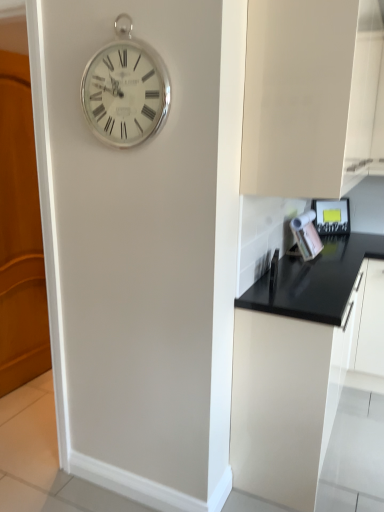
What is the approximate width of silver metallic clock at upper center?

silver metallic clock at upper center is 3.44 centimeters wide.

Describe the element at coordinates (20, 234) in the screenshot. I see `wooden at left` at that location.

From the picture: How much space does black matte cabinet at lower right, positioned as the 2th cabinetry in top-to-bottom order, occupy horizontally?

The width of black matte cabinet at lower right, positioned as the 2th cabinetry in top-to-bottom order, is 16.75 inches.

I want to click on matte white cabinet at upper right, which appears as the 2th cabinetry when ordered from the bottom, so (x=311, y=99).

What are the coordinates of `silver metallic clock at upper center` in the screenshot? It's located at (125, 92).

Is wooden at left oriented away from black matte cabinet at lower right, positioned as the 2th cabinetry in top-to-bottom order?

wooden at left does not have its back to black matte cabinet at lower right, positioned as the 2th cabinetry in top-to-bottom order.

From a real-world perspective, is wooden at left under black matte cabinet at lower right, positioned as the 2th cabinetry in top-to-bottom order?

No, from a real-world perspective, wooden at left is not below black matte cabinet at lower right, positioned as the 2th cabinetry in top-to-bottom order.

Is metallic silver toaster at right not near matte white cabinet at upper right, which appears as the 2th cabinetry when ordered from the bottom?

Absolutely, metallic silver toaster at right is distant from matte white cabinet at upper right, which appears as the 2th cabinetry when ordered from the bottom.

Where is `the 1st cabinetry to the left when counting from the metallic silver toaster at right`? The height and width of the screenshot is (512, 384). the 1st cabinetry to the left when counting from the metallic silver toaster at right is located at coordinates 311,99.

Which of these two, matte white cabinet at upper right, marked as the 1th cabinetry in a top-to-bottom arrangement, or metallic silver toaster at right, is thinner?

With smaller width is metallic silver toaster at right.

Is point (324, 120) positioned behind point (331, 208)?

No.

Is matte white cabinet at upper right, which appears as the 2th cabinetry when ordered from the bottom, positioned with its back to metallic silver toaster at right?

No, matte white cabinet at upper right, which appears as the 2th cabinetry when ordered from the bottom, is not facing the opposite direction of metallic silver toaster at right.

Consider the image. Is matte white cabinet at upper right, which appears as the 2th cabinetry when ordered from the bottom, next to metallic silver toaster at right and touching it?

No, matte white cabinet at upper right, which appears as the 2th cabinetry when ordered from the bottom, is not making contact with metallic silver toaster at right.

From a real-world perspective, is silver metallic clock at upper center above or below metallic silver toaster at right?

From a real-world perspective, silver metallic clock at upper center is physically above metallic silver toaster at right.

Considering the relative sizes of silver metallic clock at upper center and metallic silver toaster at right in the image provided, is silver metallic clock at upper center shorter than metallic silver toaster at right?

No.

In the image, is silver metallic clock at upper center positioned in front of or behind metallic silver toaster at right?

Clearly, silver metallic clock at upper center is in front of metallic silver toaster at right.

Between silver metallic clock at upper center and metallic silver toaster at right, which one has larger size?

Bigger between the two is metallic silver toaster at right.

Is point (314, 21) closer or farther from the camera than point (292, 359)?

Point (314, 21).

Based on their sizes in the image, would you say matte white cabinet at upper right, which appears as the 2th cabinetry when ordered from the bottom, is bigger or smaller than black matte cabinet at lower right, placed as the first cabinetry when sorted from bottom to top?

Considering their sizes, matte white cabinet at upper right, which appears as the 2th cabinetry when ordered from the bottom, takes up less space than black matte cabinet at lower right, placed as the first cabinetry when sorted from bottom to top.

From the image's perspective, would you say matte white cabinet at upper right, which appears as the 2th cabinetry when ordered from the bottom, is shown under black matte cabinet at lower right, positioned as the 2th cabinetry in top-to-bottom order?

Incorrect, from the image's perspective, matte white cabinet at upper right, which appears as the 2th cabinetry when ordered from the bottom, is higher than black matte cabinet at lower right, positioned as the 2th cabinetry in top-to-bottom order.

From a real-world perspective, which is physically below, black matte cabinet at lower right, placed as the first cabinetry when sorted from bottom to top, or metallic silver toaster at right?

black matte cabinet at lower right, placed as the first cabinetry when sorted from bottom to top, is physically lower.

Considering the points (249, 402) and (333, 211), which point is in front, point (249, 402) or point (333, 211)?

Positioned in front is point (249, 402).

Considering the relative sizes of black matte cabinet at lower right, positioned as the 2th cabinetry in top-to-bottom order, and metallic silver toaster at right in the image provided, is black matte cabinet at lower right, positioned as the 2th cabinetry in top-to-bottom order, taller than metallic silver toaster at right?

Yes, black matte cabinet at lower right, positioned as the 2th cabinetry in top-to-bottom order, is taller than metallic silver toaster at right.

Can you confirm if black matte cabinet at lower right, positioned as the 2th cabinetry in top-to-bottom order, is bigger than silver metallic clock at upper center?

Yes.

From the image's perspective, which one is positioned higher, black matte cabinet at lower right, positioned as the 2th cabinetry in top-to-bottom order, or silver metallic clock at upper center?

silver metallic clock at upper center is shown above in the image.

From a real-world perspective, is black matte cabinet at lower right, placed as the first cabinetry when sorted from bottom to top, located higher than silver metallic clock at upper center?

Incorrect, from a real-world perspective, black matte cabinet at lower right, placed as the first cabinetry when sorted from bottom to top, is lower than silver metallic clock at upper center.

Is silver metallic clock at upper center at the back of black matte cabinet at lower right, positioned as the 2th cabinetry in top-to-bottom order?

That's not correct — black matte cabinet at lower right, positioned as the 2th cabinetry in top-to-bottom order, is not looking away from silver metallic clock at upper center.

Which cabinetry is the 1st one when counting from the front of the wooden at left? Please provide its 2D coordinates.

[(300, 364)]

Locate an element on the screen. The width and height of the screenshot is (384, 512). appliance behind the matte white cabinet at upper right, which appears as the 2th cabinetry when ordered from the bottom is located at coordinates (332, 216).

Estimate the real-world distances between objects in this image. Which object is closer to black matte cabinet at lower right, positioned as the 2th cabinetry in top-to-bottom order, wooden at left or metallic silver toaster at right?

Among the two, metallic silver toaster at right is located nearer to black matte cabinet at lower right, positioned as the 2th cabinetry in top-to-bottom order.

Looking at the image, which one is located further to wooden at left, black matte cabinet at lower right, placed as the first cabinetry when sorted from bottom to top, or matte white cabinet at upper right, which appears as the 2th cabinetry when ordered from the bottom?

The object further to wooden at left is black matte cabinet at lower right, placed as the first cabinetry when sorted from bottom to top.

Estimate the real-world distances between objects in this image. Which object is further from matte white cabinet at upper right, which appears as the 2th cabinetry when ordered from the bottom, black matte cabinet at lower right, positioned as the 2th cabinetry in top-to-bottom order, or metallic silver toaster at right?

metallic silver toaster at right lies further to matte white cabinet at upper right, which appears as the 2th cabinetry when ordered from the bottom, than the other object.

Based on their spatial positions, is matte white cabinet at upper right, marked as the 1th cabinetry in a top-to-bottom arrangement, or black matte cabinet at lower right, positioned as the 2th cabinetry in top-to-bottom order, further from wooden at left?

black matte cabinet at lower right, positioned as the 2th cabinetry in top-to-bottom order, is further to wooden at left.

Looking at the image, which one is located further to black matte cabinet at lower right, positioned as the 2th cabinetry in top-to-bottom order, matte white cabinet at upper right, which appears as the 2th cabinetry when ordered from the bottom, or wooden at left?

wooden at left.

Consider the image. Looking at the image, which one is located closer to matte white cabinet at upper right, marked as the 1th cabinetry in a top-to-bottom arrangement, wooden at left or metallic silver toaster at right?

Among the two, metallic silver toaster at right is located nearer to matte white cabinet at upper right, marked as the 1th cabinetry in a top-to-bottom arrangement.

When comparing their distances from silver metallic clock at upper center, does matte white cabinet at upper right, marked as the 1th cabinetry in a top-to-bottom arrangement, or metallic silver toaster at right seem closer?

Based on the image, matte white cabinet at upper right, marked as the 1th cabinetry in a top-to-bottom arrangement, appears to be nearer to silver metallic clock at upper center.

Looking at this image, from the image, which object appears to be nearer to matte white cabinet at upper right, marked as the 1th cabinetry in a top-to-bottom arrangement, metallic silver toaster at right or silver metallic clock at upper center?

silver metallic clock at upper center is closer to matte white cabinet at upper right, marked as the 1th cabinetry in a top-to-bottom arrangement.

You are a GUI agent. You are given a task and a screenshot of the screen. Output one action in this format:
    pyautogui.click(x=<x>, y=<y>)
    Task: Click on the wall clock between wooden at left and black matte cabinet at lower right, placed as the first cabinetry when sorted from bottom to top
    This screenshot has width=384, height=512.
    Given the screenshot: What is the action you would take?
    pyautogui.click(x=125, y=92)

You are a GUI agent. You are given a task and a screenshot of the screen. Output one action in this format:
    pyautogui.click(x=<x>, y=<y>)
    Task: Click on the wall clock located between wooden at left and metallic silver toaster at right in the left-right direction
    
    Given the screenshot: What is the action you would take?
    pyautogui.click(x=125, y=92)

Where is `cabinetry between matte white cabinet at upper right, marked as the 1th cabinetry in a top-to-bottom arrangement, and metallic silver toaster at right, along the z-axis`? This screenshot has height=512, width=384. cabinetry between matte white cabinet at upper right, marked as the 1th cabinetry in a top-to-bottom arrangement, and metallic silver toaster at right, along the z-axis is located at coordinates (x=300, y=364).

Identify the location of cabinetry between silver metallic clock at upper center and metallic silver toaster at right from front to back. (300, 364).